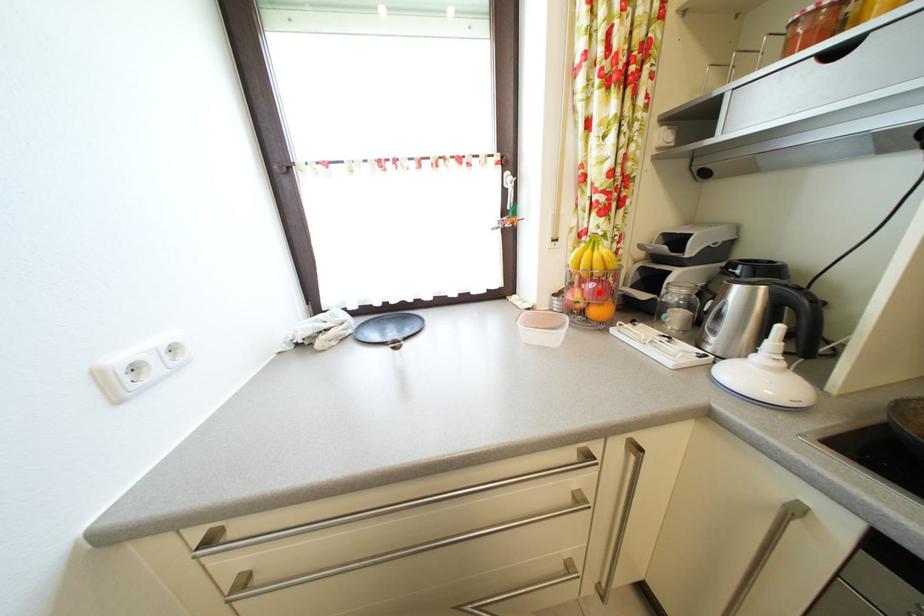
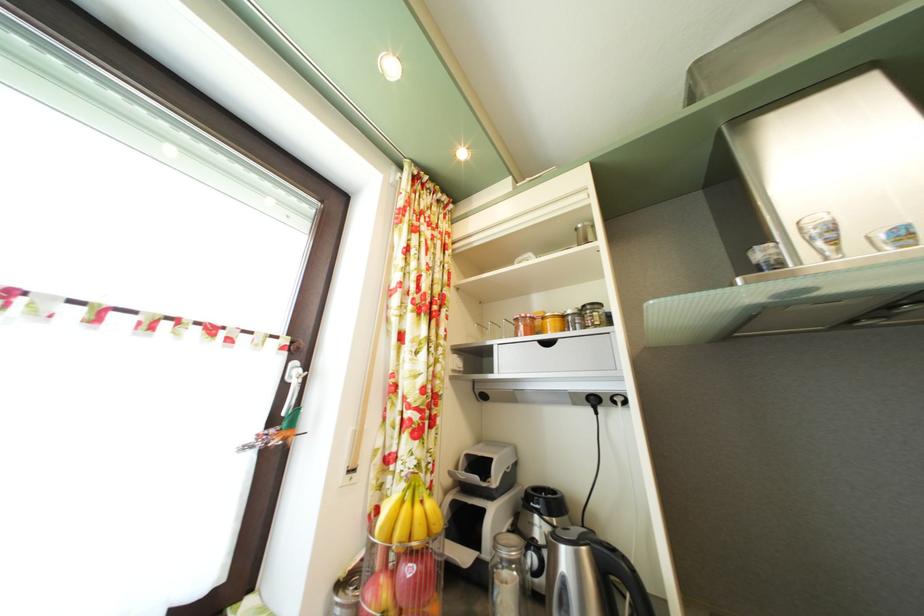
Question: I am providing you with two images of the same scene from different viewpoints. A red point is marked on the first image. At the location where the point appears in image 1, is it still visible in image 2?

Choices:
 (A) Yes
 (B) No

Answer: (A)